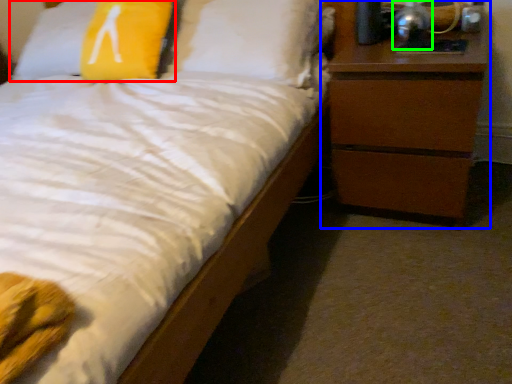
Question: Which is farther away from pillow (highlighted by a red box)? chest of drawers (highlighted by a blue box) or bedside lamp (highlighted by a green box)?

Choices:
 (A) chest of drawers
 (B) bedside lamp

Answer: (B)